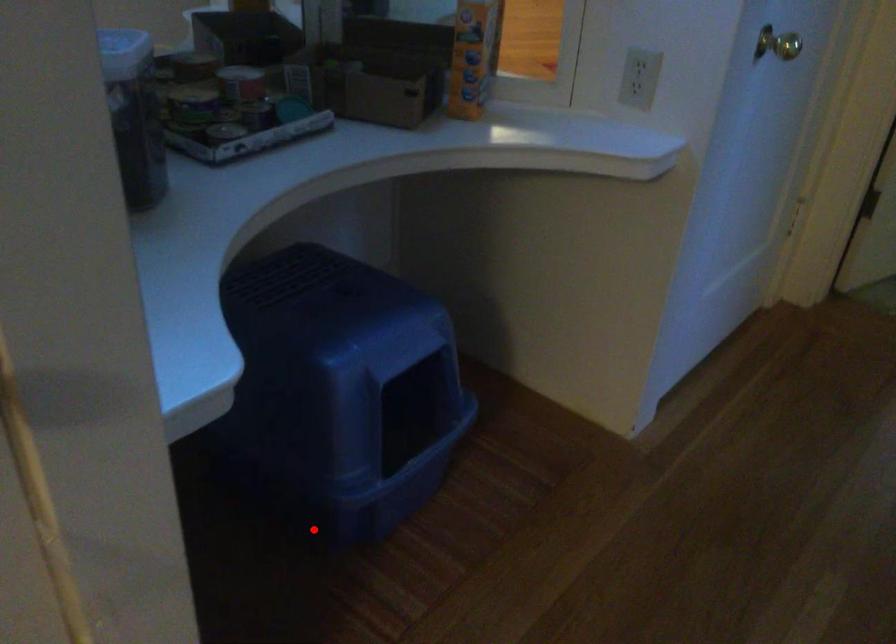
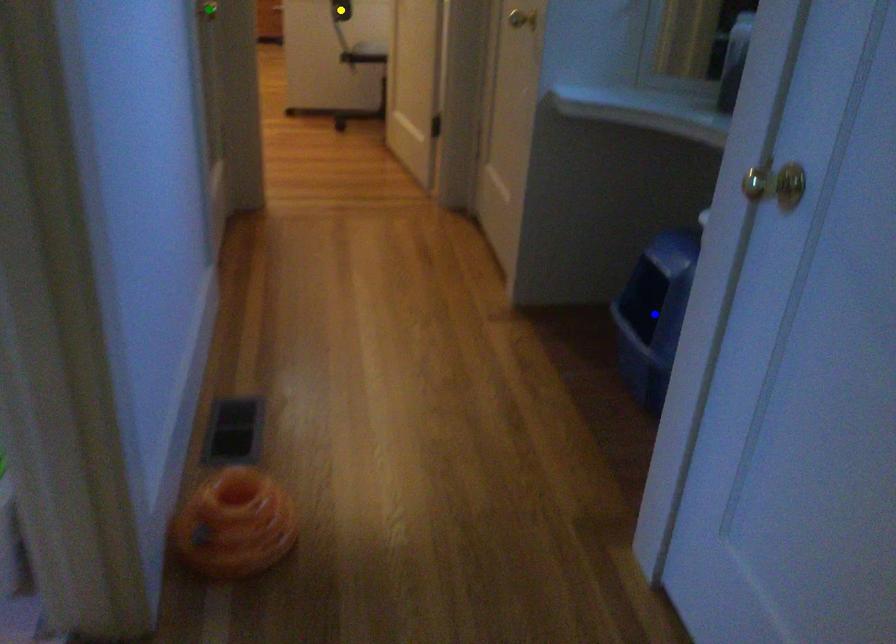
Question: I am providing you with two images of the same scene from different viewpoints. A red point is marked on the first image. You are given multiple points on the second image. Which point in image 2 represents the same 3d spot as the red point in image 1?

Choices:
 (A) yellow point
 (B) blue point
 (C) green point

Answer: (B)